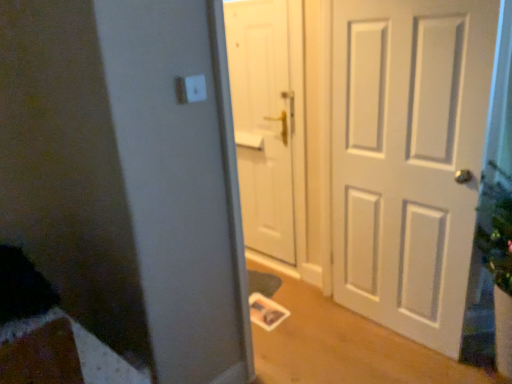
This screenshot has height=384, width=512. I want to click on white matte door at center, which is the 1th door in left-to-right order, so click(262, 122).

From a real-world perspective, which object rests below the other?

In real-world perspective, white matte door at right, the first door positioned from the right, is lower.

How many degrees apart are the facing directions of white matte door at right, the 2th door from the left, and white plastic light switch at upper center?

The angle between the facing direction of white matte door at right, the 2th door from the left, and the facing direction of white plastic light switch at upper center is 95.3 degrees.

Considering the points (473, 202) and (199, 90), which point is in front, point (473, 202) or point (199, 90)?

The point (199, 90) is closer.

Based on the photo, is white matte door at right, the 2th door from the left, thinner than white plastic light switch at upper center?

Incorrect, the width of white matte door at right, the 2th door from the left, is not less than that of white plastic light switch at upper center.

From a real-world perspective, between white matte door at center, the 2th door from the right, and white plastic light switch at upper center, who is vertically lower?

white matte door at center, the 2th door from the right.

Measure the distance from white matte door at center, the 2th door from the right, to white plastic light switch at upper center.

A distance of 4.10 feet exists between white matte door at center, the 2th door from the right, and white plastic light switch at upper center.

Considering the sizes of objects white matte door at center, which is the 1th door in left-to-right order, and white plastic light switch at upper center in the image provided, who is shorter, white matte door at center, which is the 1th door in left-to-right order, or white plastic light switch at upper center?

white plastic light switch at upper center.

Is there a large distance between white matte door at center, the 2th door from the right, and white plastic light switch at upper center?

Yes, white matte door at center, the 2th door from the right, and white plastic light switch at upper center are located far from each other.

Considering the positions of objects white plastic light switch at upper center and white matte door at right, the 2th door from the left, in the image provided, who is more to the left, white plastic light switch at upper center or white matte door at right, the 2th door from the left,?

white plastic light switch at upper center.

Is point (194, 85) closer or farther from the camera than point (240, 50)?

Point (194, 85) is closer to the camera than point (240, 50).

Is white plastic light switch at upper center facing towards white matte door at right, the first door positioned from the right?

No, white plastic light switch at upper center is not turned towards white matte door at right, the first door positioned from the right.

In order to click on door directly beneath the white matte door at center, the 2th door from the right (from a real-world perspective) in this screenshot , I will do (x=367, y=149).

How far apart are white matte door at right, the first door positioned from the right, and white matte door at center, the 2th door from the right?

11.60 inches.

Considering their positions, is white matte door at right, the first door positioned from the right, located in front of or behind white matte door at center, which is the 1th door in left-to-right order?

Clearly, white matte door at right, the first door positioned from the right, is in front of white matte door at center, which is the 1th door in left-to-right order.

Which is in front, point (283, 217) or point (280, 254)?

The point (283, 217) is closer.

Is white matte door at center, the 2th door from the right, facing away from white matte door at right, the 2th door from the left?

No.

Between white matte door at center, which is the 1th door in left-to-right order, and white matte door at right, the 2th door from the left, which one has larger width?

Wider between the two is white matte door at right, the 2th door from the left.

Between white matte door at center, the 2th door from the right, and white matte door at right, the first door positioned from the right, which one has less height?

Standing shorter between the two is white matte door at right, the first door positioned from the right.

Is white matte door at center, the 2th door from the right, not inside white matte door at right, the first door positioned from the right?

white matte door at center, the 2th door from the right, is positioned outside white matte door at right, the first door positioned from the right.

Locate an element on the screen. The width and height of the screenshot is (512, 384). light switch lying in front of the white matte door at center, the 2th door from the right is located at coordinates (195, 88).

From the image's perspective, is white plastic light switch at upper center positioned above or below white matte door at center, which is the 1th door in left-to-right order?

Clearly, from the image's perspective, white plastic light switch at upper center is above white matte door at center, which is the 1th door in left-to-right order.

Is white plastic light switch at upper center oriented away from white matte door at center, the 2th door from the right?

That's not correct — white plastic light switch at upper center is not looking away from white matte door at center, the 2th door from the right.

Which object is positioned more to the left, white plastic light switch at upper center or white matte door at center, which is the 1th door in left-to-right order?

From the viewer's perspective, white plastic light switch at upper center appears more on the left side.

This screenshot has height=384, width=512. I want to click on light switch on the left of white matte door at right, the 2th door from the left, so click(x=195, y=88).

What are the coordinates of `light switch in front of the white matte door at center, which is the 1th door in left-to-right order` in the screenshot? It's located at (195, 88).

From the image, which object appears to be nearer to white matte door at right, the 2th door from the left, white matte door at center, the 2th door from the right, or white plastic light switch at upper center?

Among the two, white matte door at center, the 2th door from the right, is located nearer to white matte door at right, the 2th door from the left.

In the scene shown: Looking at the image, which one is located closer to white matte door at right, the first door positioned from the right, white plastic light switch at upper center or white matte door at center, the 2th door from the right?

Among the two, white matte door at center, the 2th door from the right, is located nearer to white matte door at right, the first door positioned from the right.

Based on their spatial positions, is white matte door at right, the first door positioned from the right, or white matte door at center, the 2th door from the right, further from white plastic light switch at upper center?

white matte door at center, the 2th door from the right, is positioned further to the anchor white plastic light switch at upper center.

Considering their positions, is white matte door at right, the 2th door from the left, positioned further to white matte door at center, which is the 1th door in left-to-right order, than white plastic light switch at upper center?

white plastic light switch at upper center is positioned further to the anchor white matte door at center, which is the 1th door in left-to-right order.

From the image, which object appears to be farther from white matte door at center, which is the 1th door in left-to-right order, white plastic light switch at upper center or white matte door at right, the first door positioned from the right?

The object further to white matte door at center, which is the 1th door in left-to-right order, is white plastic light switch at upper center.

Which object lies nearer to the anchor point white plastic light switch at upper center, white matte door at center, the 2th door from the right, or white matte door at right, the first door positioned from the right?

white matte door at right, the first door positioned from the right, is positioned closer to the anchor white plastic light switch at upper center.

Where is `door between white plastic light switch at upper center and white matte door at center, the 2th door from the right, along the z-axis`? This screenshot has width=512, height=384. door between white plastic light switch at upper center and white matte door at center, the 2th door from the right, along the z-axis is located at coordinates (367, 149).